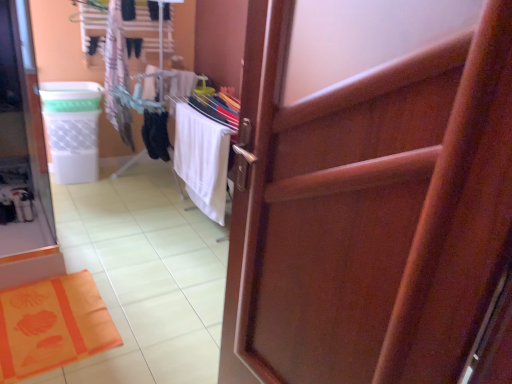
What do you see at coordinates (371, 211) in the screenshot? I see `wooden door at center` at bounding box center [371, 211].

Measure the distance between point (55,94) and camera.

Point (55,94) and camera are 3.17 meters apart.

The image size is (512, 384). What do you see at coordinates (52, 325) in the screenshot?
I see `orange fabric bath mat at lower left` at bounding box center [52, 325].

Looking at this image, what is the approximate height of white fabric beach towel at center?

It is 74.71 centimeters.

Where is `wooden door at center`? wooden door at center is located at coordinates (371, 211).

How distant is white plastic laundry basket at left from wooden door at center?

A distance of 2.62 meters exists between white plastic laundry basket at left and wooden door at center.

Is white plastic laundry basket at left aimed at wooden door at center?

Yes, white plastic laundry basket at left is oriented towards wooden door at center.

Can you confirm if white plastic laundry basket at left is bigger than wooden door at center?

No.

Can you confirm if white plastic laundry basket at left is taller than wooden door at center?

No.

Between white fabric beach towel at center and wooden door at center, which one is positioned in front?

wooden door at center is more forward.

Is white fabric beach towel at center looking in the opposite direction of wooden door at center?

No, wooden door at center is not at the back of white fabric beach towel at center.

Is white fabric beach towel at center at the left side of wooden door at center?

Correct, you'll find white fabric beach towel at center to the left of wooden door at center.

Can we say white fabric beach towel at center lies outside orange fabric bath mat at lower left?

Yes, white fabric beach towel at center is outside of orange fabric bath mat at lower left.

Is point (226, 178) more distant than point (83, 288)?

Yes, point (226, 178) is behind point (83, 288).

Is white fabric beach towel at center wider or thinner than orange fabric bath mat at lower left?

In the image, white fabric beach towel at center appears to be more narrow than orange fabric bath mat at lower left.

How far apart are white cotton towel at upper left and wooden door at center?

They are 2.42 meters apart.

Are white cotton towel at upper left and wooden door at center located far from each other?

Yes, white cotton towel at upper left and wooden door at center are located far from each other.

Is point (124, 141) farther from camera compared to point (475, 292)?

That is True.

Considering the positions of objects white cotton towel at upper left and wooden door at center in the image provided, who is more to the left, white cotton towel at upper left or wooden door at center?

white cotton towel at upper left.

From the image's perspective, is white plastic laundry basket at left beneath white fabric beach towel at center?

Actually, white plastic laundry basket at left appears above white fabric beach towel at center in the image.

Is white plastic laundry basket at left to the left or to the right of white fabric beach towel at center in the image?

Based on their positions, white plastic laundry basket at left is located to the left of white fabric beach towel at center.

Would you say white plastic laundry basket at left is inside or outside white fabric beach towel at center?

The correct answer is: outside.

Considering the relative sizes of white plastic laundry basket at left and white fabric beach towel at center in the image provided, is white plastic laundry basket at left taller than white fabric beach towel at center?

Incorrect, the height of white plastic laundry basket at left is not larger of that of white fabric beach towel at center.

Can we say wooden door at center lies outside white plastic laundry basket at left?

Yes.

Does wooden door at center have a lesser height compared to white plastic laundry basket at left?

No.

Is wooden door at center positioned far away from white plastic laundry basket at left?

Yes.

From a real-world perspective, is white cotton towel at upper left on top of orange fabric bath mat at lower left?

Yes.

Does point (118, 46) come behind point (101, 304)?

That is True.

In terms of size, does white cotton towel at upper left appear bigger or smaller than orange fabric bath mat at lower left?

In the image, white cotton towel at upper left appears to be larger than orange fabric bath mat at lower left.

From the image's perspective, is white cotton towel at upper left beneath orange fabric bath mat at lower left?

No, from the image's perspective, white cotton towel at upper left is not below orange fabric bath mat at lower left.

At what (x,y) coordinates should I click in order to perform the action: click on door on the right side of white plastic laundry basket at left. Please return your answer as a coordinate pair (x, y). The image size is (512, 384). Looking at the image, I should click on (371, 211).

Identify the location of beach towel beneath the wooden door at center (from a real-world perspective). (202, 160).

Which object lies further to the anchor point white plastic laundry basket at left, wooden door at center or orange fabric bath mat at lower left?

Based on the image, wooden door at center appears to be further to white plastic laundry basket at left.

From the picture: Based on their spatial positions, is orange fabric bath mat at lower left or white fabric beach towel at center closer to white plastic laundry basket at left?

Based on the image, white fabric beach towel at center appears to be nearer to white plastic laundry basket at left.

Estimate the real-world distances between objects in this image. Which object is further from white plastic laundry basket at left, white fabric beach towel at center or orange fabric bath mat at lower left?

Among the two, orange fabric bath mat at lower left is located further to white plastic laundry basket at left.

Which object lies further to the anchor point white fabric beach towel at center, wooden door at center or white cotton towel at upper left?

Among the two, wooden door at center is located further to white fabric beach towel at center.

Based on their spatial positions, is white plastic laundry basket at left or wooden door at center closer to white cotton towel at upper left?

white plastic laundry basket at left.

Looking at the image, which one is located further to white fabric beach towel at center, orange fabric bath mat at lower left or white cotton towel at upper left?

The object further to white fabric beach towel at center is orange fabric bath mat at lower left.

Looking at the image, which one is located closer to white plastic laundry basket at left, orange fabric bath mat at lower left or wooden door at center?

orange fabric bath mat at lower left is closer to white plastic laundry basket at left.

Which object lies further to the anchor point white plastic laundry basket at left, wooden door at center or white fabric beach towel at center?

wooden door at center.

This screenshot has height=384, width=512. In order to click on bath mat between wooden door at center and white cotton towel at upper left along the z-axis in this screenshot , I will do `click(52, 325)`.

Where is `beach towel between wooden door at center and white plastic laundry basket at left along the z-axis`? The height and width of the screenshot is (384, 512). beach towel between wooden door at center and white plastic laundry basket at left along the z-axis is located at coordinates (202, 160).

This screenshot has height=384, width=512. Identify the location of beach towel between white cotton towel at upper left and orange fabric bath mat at lower left vertically. (202, 160).

In order to click on clothing between white plastic laundry basket at left and white fabric beach towel at center from left to right in this screenshot , I will do `click(117, 74)`.